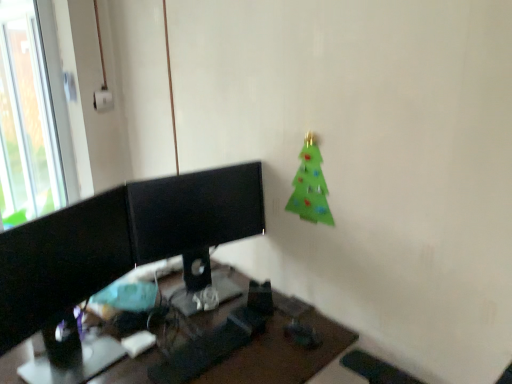
This screenshot has height=384, width=512. Describe the element at coordinates (33, 115) in the screenshot. I see `transparent glass window at upper left` at that location.

Locate an element on the screen. This screenshot has height=384, width=512. transparent glass window at upper left is located at coordinates (33, 115).

Describe the element at coordinates (282, 355) in the screenshot. This screenshot has width=512, height=384. I see `black plastic desk at center` at that location.

Image resolution: width=512 pixels, height=384 pixels. I want to click on transparent glass window at upper left, so click(33, 115).

Is black glossy monitor at left positioned beyond the bounds of black plastic desk at center?

Yes, black glossy monitor at left is not within black plastic desk at center.

From a real-world perspective, is black glossy monitor at left positioned over black plastic desk at center based on gravity?

Correct, in the physical world, black glossy monitor at left is higher than black plastic desk at center.

Based on the photo, does black glossy monitor at left have a larger size compared to black plastic desk at center?

Incorrect, black glossy monitor at left is not larger than black plastic desk at center.

Is black plastic desk at center at the back of black glossy monitor at left?

black glossy monitor at left is not turned away from black plastic desk at center.

Which point is more forward, (50, 284) or (309, 158)?

The point (50, 284) is closer.

Which of these two, black glossy monitor at left or green felt christmas tree at upper right, stands taller?

black glossy monitor at left is taller.

What's the angular difference between black glossy monitor at left and green felt christmas tree at upper right's facing directions?

The angle between the facing direction of black glossy monitor at left and the facing direction of green felt christmas tree at upper right is 90.3 degrees.

Which is in front, black glossy monitor at left or green felt christmas tree at upper right?

black glossy monitor at left is closer to the camera.

Consider the image. Is transparent glass window at upper left bigger or smaller than black glossy monitor at center?

transparent glass window at upper left is smaller than black glossy monitor at center.

Relative to black glossy monitor at center, is transparent glass window at upper left in front or behind?

In the image, transparent glass window at upper left appears behind black glossy monitor at center.

From the image's perspective, which object appears higher, transparent glass window at upper left or black glossy monitor at center?

transparent glass window at upper left.

Is transparent glass window at upper left placed right next to black glossy monitor at center?

There is a gap between transparent glass window at upper left and black glossy monitor at center.

Which point is more forward, [46,35] or [326,343]?

Point [326,343]

Is transparent glass window at upper left positioned beyond the bounds of black plastic desk at center?

Yes, transparent glass window at upper left is not within black plastic desk at center.

Considering the relative positions of transparent glass window at upper left and black plastic desk at center in the image provided, is transparent glass window at upper left to the right of black plastic desk at center from the viewer's perspective?

No.

Is black plastic desk at center thinner than black glossy monitor at center?

Incorrect, the width of black plastic desk at center is not less than that of black glossy monitor at center.

From the image's perspective, who appears lower, black plastic desk at center or black glossy monitor at center?

black plastic desk at center appears lower in the image.

From the picture: Is black plastic desk at center aimed at black glossy monitor at center?

No, black plastic desk at center is not turned towards black glossy monitor at center.

Is point (340, 336) closer or farther from the camera than point (257, 215)?

Point (340, 336) is closer to the camera than point (257, 215).

The image size is (512, 384). Identify the location of computer monitor above the black glossy monitor at center (from a real-world perspective). (62, 262).

How different are the orientations of black glossy monitor at center and black glossy monitor at left in degrees?

black glossy monitor at center and black glossy monitor at left are facing 0.00184 degrees away from each other.

Considering the relative sizes of black glossy monitor at center and black glossy monitor at left in the image provided, is black glossy monitor at center shorter than black glossy monitor at left?

Correct, black glossy monitor at center is not as tall as black glossy monitor at left.

Considering the sizes of objects black glossy monitor at center and black glossy monitor at left in the image provided, who is bigger, black glossy monitor at center or black glossy monitor at left?

Bigger between the two is black glossy monitor at center.

Is black plastic desk at center far from transparent glass window at upper left?

Yes, black plastic desk at center is far from transparent glass window at upper left.

Considering the sizes of black plastic desk at center and transparent glass window at upper left in the image, is black plastic desk at center wider or thinner than transparent glass window at upper left?

Considering their sizes, black plastic desk at center looks broader than transparent glass window at upper left.

Is black plastic desk at center in front of transparent glass window at upper left?

Yes, the depth of black plastic desk at center is less than that of transparent glass window at upper left.

From a real-world perspective, between black plastic desk at center and transparent glass window at upper left, who is vertically lower?

black plastic desk at center, from a real-world perspective.

This screenshot has height=384, width=512. Identify the location of desk lying below the black glossy monitor at left (from the image's perspective). (282, 355).

The width and height of the screenshot is (512, 384). Identify the location of christmas tree behind the black glossy monitor at left. (310, 186).

Which object lies nearer to the anchor point black plastic desk at center, black glossy monitor at left or black glossy monitor at center?

The object closer to black plastic desk at center is black glossy monitor at center.

In the scene shown: Estimate the real-world distances between objects in this image. Which object is further from black glossy monitor at center, transparent glass window at upper left or black plastic desk at center?

transparent glass window at upper left is further to black glossy monitor at center.

Looking at the image, which one is located closer to black glossy monitor at left, green felt christmas tree at upper right or black glossy monitor at center?

Based on the image, black glossy monitor at center appears to be nearer to black glossy monitor at left.

Based on their spatial positions, is black glossy monitor at left or transparent glass window at upper left closer to black glossy monitor at center?

Among the two, black glossy monitor at left is located nearer to black glossy monitor at center.

Estimate the real-world distances between objects in this image. Which object is further from transparent glass window at upper left, black glossy monitor at center or black plastic desk at center?

Among the two, black plastic desk at center is located further to transparent glass window at upper left.

Consider the image. Considering their positions, is transparent glass window at upper left positioned closer to black plastic desk at center than green felt christmas tree at upper right?

green felt christmas tree at upper right is closer to black plastic desk at center.

Which object lies further to the anchor point green felt christmas tree at upper right, black glossy monitor at left or transparent glass window at upper left?

Based on the image, transparent glass window at upper left appears to be further to green felt christmas tree at upper right.

Which object lies further to the anchor point black plastic desk at center, black glossy monitor at center or black glossy monitor at left?

black glossy monitor at left.

At what (x,y) coordinates should I click in order to perform the action: click on desktop computer between black glossy monitor at left and green felt christmas tree at upper right. Please return your answer as a coordinate pair (x, y). Looking at the image, I should click on (195, 210).

Find the location of a particular element. This screenshot has width=512, height=384. desktop computer between green felt christmas tree at upper right and black plastic desk at center from top to bottom is located at coordinates (195, 210).

Locate an element on the screen. The image size is (512, 384). computer monitor situated between transparent glass window at upper left and black glossy monitor at center from left to right is located at coordinates (62, 262).

Where is `computer monitor between green felt christmas tree at upper right and black plastic desk at center in the up-down direction`? computer monitor between green felt christmas tree at upper right and black plastic desk at center in the up-down direction is located at coordinates (62, 262).